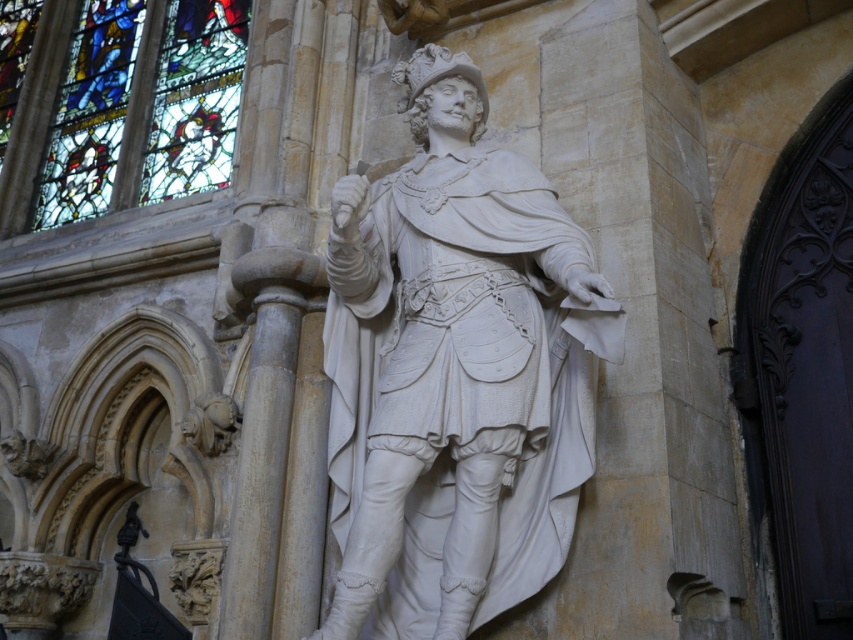
Can you confirm if white marble statue at center is wider than stained glass window at upper left?

No.

Is white marble statue at center bigger than stained glass window at upper left?

Actually, white marble statue at center might be smaller than stained glass window at upper left.

Who is more forward, (x=546, y=355) or (x=167, y=6)?

Point (x=546, y=355)

This screenshot has width=853, height=640. In order to click on white marble statue at center in this screenshot , I will do `click(456, 372)`.